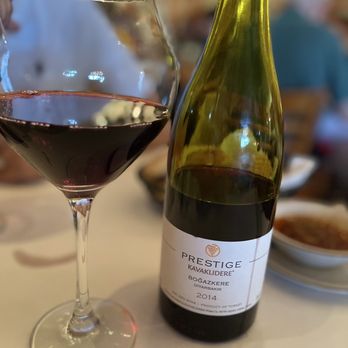
The width and height of the screenshot is (348, 348). In order to click on white bowl in this screenshot , I will do `click(310, 252)`.